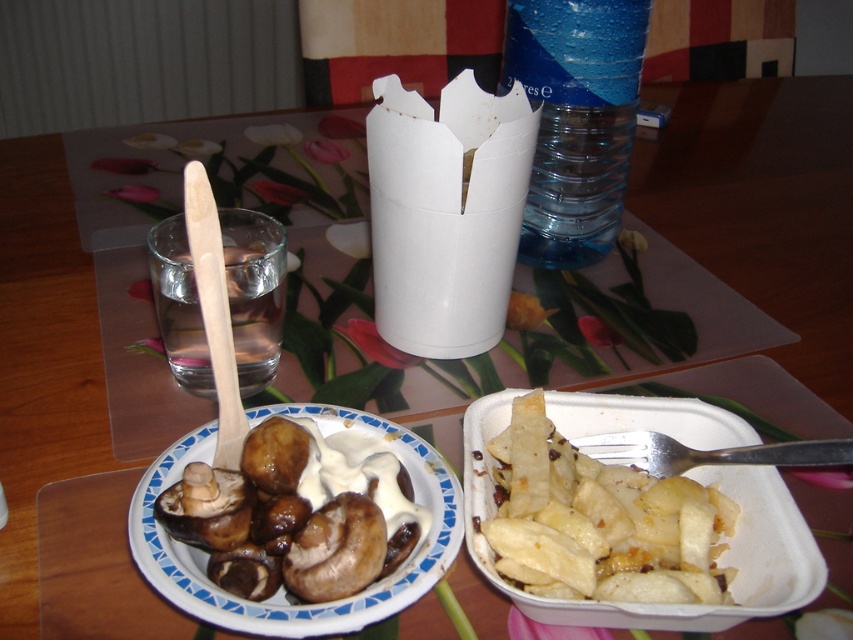
Question: Can you confirm if brown glossy mushrooms at left is thinner than blue plastic bottle at upper center?

Choices:
 (A) yes
 (B) no

Answer: (B)

Question: Which of these objects is positioned farthest from the white matte potato wedges at lower right?

Choices:
 (A) blue plastic bottle at upper center
 (B) brown glossy mushrooms at left

Answer: (A)

Question: Is brown glossy mushrooms at left closer to camera compared to blue plastic bottle at upper center?

Choices:
 (A) yes
 (B) no

Answer: (A)

Question: Considering the real-world distances, which object is farthest from the white matte potato wedges at lower right?

Choices:
 (A) brown glossy mushrooms at left
 (B) blue plastic bottle at upper center

Answer: (B)

Question: Which of the following is the farthest from the observer?

Choices:
 (A) brown glossy mushrooms at left
 (B) blue plastic bottle at upper center
 (C) white matte potato wedges at lower right

Answer: (B)

Question: Can you confirm if white matte potato wedges at lower right is smaller than blue plastic bottle at upper center?

Choices:
 (A) yes
 (B) no

Answer: (A)